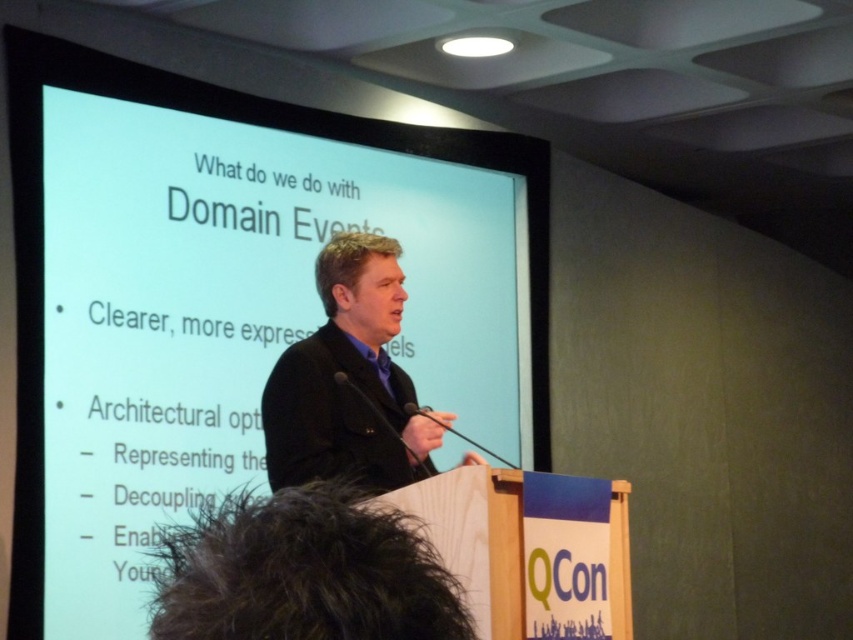
Question: Does white glossy projection screen at upper center have a greater width compared to black matte business suit at center?

Choices:
 (A) yes
 (B) no

Answer: (A)

Question: Which point is farther from the camera taking this photo?

Choices:
 (A) (289, 440)
 (B) (541, 164)

Answer: (B)

Question: Which point is closer to the camera taking this photo?

Choices:
 (A) (366, 483)
 (B) (460, 304)

Answer: (A)

Question: Observing the image, what is the correct spatial positioning of white glossy projection screen at upper center in reference to black matte business suit at center?

Choices:
 (A) above
 (B) below

Answer: (A)

Question: Does white glossy projection screen at upper center appear over black matte business suit at center?

Choices:
 (A) no
 (B) yes

Answer: (B)